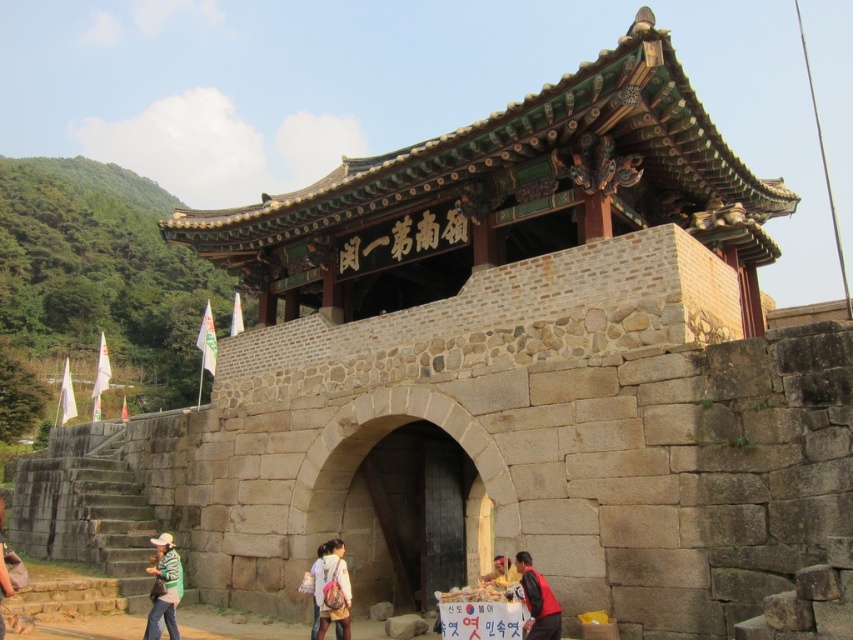
Can you confirm if dark red leather jacket at lower center is shorter than green fabric bag at lower left?

Yes.

Is dark red leather jacket at lower center thinner than green fabric bag at lower left?

Correct, dark red leather jacket at lower center's width is less than green fabric bag at lower left's.

Is point (519, 554) closer to viewer compared to point (9, 579)?

That is True.

Locate an element on the screen. Image resolution: width=853 pixels, height=640 pixels. dark red leather jacket at lower center is located at coordinates (537, 602).

Based on the photo, which of these two, light pink fabric backpack at lower center or yellow fabric bag at center, stands shorter?

With less height is light pink fabric backpack at lower center.

In the scene shown: Does light pink fabric backpack at lower center have a greater width compared to yellow fabric bag at center?

Incorrect, light pink fabric backpack at lower center's width does not surpass yellow fabric bag at center's.

Between point (321, 566) and point (505, 556), which one is positioned in front?

Point (505, 556)

At what (x,y) coordinates should I click in order to perform the action: click on light pink fabric backpack at lower center. Please return your answer as a coordinate pair (x, y). This screenshot has height=640, width=853. Looking at the image, I should click on (334, 588).

Is dark brown wood at center bigger than green striped shirt at lower left?

Correct, dark brown wood at center is larger in size than green striped shirt at lower left.

Can you confirm if dark brown wood at center is positioned above green striped shirt at lower left?

Yes, dark brown wood at center is above green striped shirt at lower left.

Find the location of a particular element. dark brown wood at center is located at coordinates (419, 509).